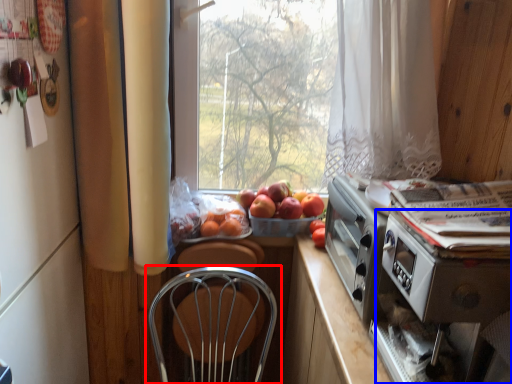
Question: Which of the following is the farthest to the observer, chair (highlighted by a red box) or appliance (highlighted by a blue box)?

Choices:
 (A) chair
 (B) appliance

Answer: (A)